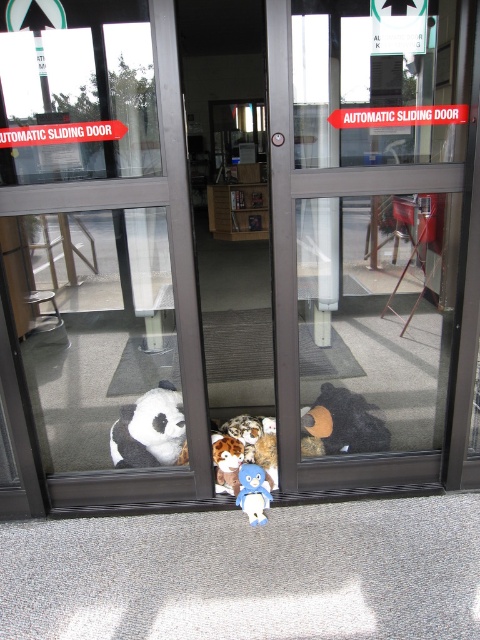
Is fluffy plush bear at center wider than blue plush toy at center?

No.

Is point (227, 483) positioned in front of point (248, 488)?

No, it is behind (248, 488).

The width and height of the screenshot is (480, 640). I want to click on fluffy plush bear at center, so click(x=227, y=461).

Measure the distance between white plush at lower left and fluffy plush bear at center.

white plush at lower left and fluffy plush bear at center are 11.15 inches apart from each other.

Does white plush at lower left appear under fluffy plush bear at center?

No.

Identify the location of white plush at lower left. (148, 429).

In order to click on white plush at lower left in this screenshot , I will do `click(148, 429)`.

Can you confirm if white plush at lower left is positioned above blue plush toy at center?

Yes.

The height and width of the screenshot is (640, 480). Identify the location of white plush at lower left. (148, 429).